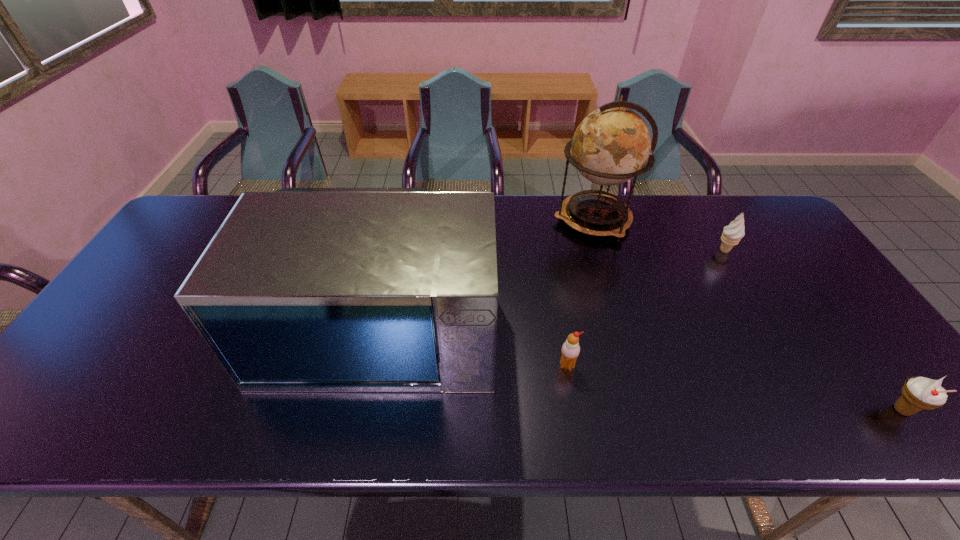
Locate an element on the screen. free space located at the center of the third object from left to right is located at coordinates (476, 220).

Find the location of `free location located 0.180m at the center of the third object from left to right`. free location located 0.180m at the center of the third object from left to right is located at coordinates (497, 220).

This screenshot has height=540, width=960. I want to click on vacant space situated at the center of the third object from left to right, so click(x=452, y=220).

Where is `free spot located 0.060m on the front-facing side of the second tallest object`? free spot located 0.060m on the front-facing side of the second tallest object is located at coordinates (363, 417).

Locate an element on the screen. The height and width of the screenshot is (540, 960). vacant space located 0.250m on the front-facing side of the fourth object from left to right is located at coordinates (633, 251).

This screenshot has width=960, height=540. Find the location of `vacant space located on the front-facing side of the fourth object from left to right`. vacant space located on the front-facing side of the fourth object from left to right is located at coordinates (668, 251).

Locate an element on the screen. The height and width of the screenshot is (540, 960). free spot located on the front-facing side of the fourth object from left to right is located at coordinates (639, 251).

This screenshot has height=540, width=960. I want to click on vacant area situated at the front with a straw on the leftmost icecream, so click(578, 430).

Identify the location of vacant space located 0.280m on the back of the nearest object. (823, 302).

At what (x,y) coordinates should I click in order to perform the action: click on object present at the far edge. Please return your answer as a coordinate pair (x, y). The height and width of the screenshot is (540, 960). Looking at the image, I should click on (611, 145).